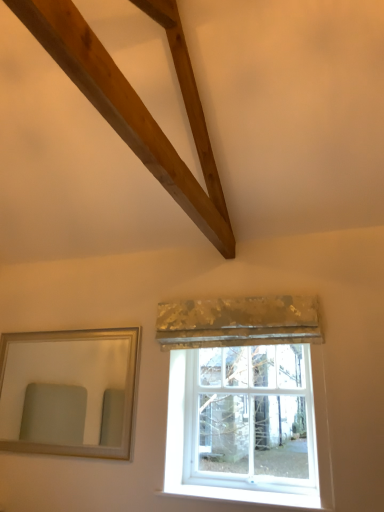
Question: Considering the relative sizes of white glass window at center and gold sequined curtain at center in the image provided, is white glass window at center smaller than gold sequined curtain at center?

Choices:
 (A) no
 (B) yes

Answer: (A)

Question: Can you confirm if white glass window at center is shorter than gold sequined curtain at center?

Choices:
 (A) yes
 (B) no

Answer: (B)

Question: Does white glass window at center have a greater height compared to gold sequined curtain at center?

Choices:
 (A) no
 (B) yes

Answer: (B)

Question: Considering the relative positions of white glass window at center and gold sequined curtain at center in the image provided, is white glass window at center in front of gold sequined curtain at center?

Choices:
 (A) yes
 (B) no

Answer: (B)

Question: Is gold sequined curtain at center surrounded by white glass window at center?

Choices:
 (A) yes
 (B) no

Answer: (B)

Question: Is white glass window at center looking in the opposite direction of gold sequined curtain at center?

Choices:
 (A) yes
 (B) no

Answer: (B)

Question: Could you tell me if white glass window at center is facing silver/golden-framed mirror at left?

Choices:
 (A) yes
 (B) no

Answer: (B)

Question: Is white glass window at center directly adjacent to silver/golden-framed mirror at left?

Choices:
 (A) no
 (B) yes

Answer: (A)

Question: Is white glass window at center not close to silver/golden-framed mirror at left?

Choices:
 (A) no
 (B) yes

Answer: (B)

Question: Is white glass window at center positioned beyond the bounds of silver/golden-framed mirror at left?

Choices:
 (A) yes
 (B) no

Answer: (A)

Question: From a real-world perspective, is white glass window at center positioned under silver/golden-framed mirror at left based on gravity?

Choices:
 (A) yes
 (B) no

Answer: (A)

Question: Is the position of white glass window at center less distant than that of silver/golden-framed mirror at left?

Choices:
 (A) yes
 (B) no

Answer: (A)

Question: Is gold sequined curtain at center to the right of silver/golden-framed mirror at left from the viewer's perspective?

Choices:
 (A) yes
 (B) no

Answer: (A)